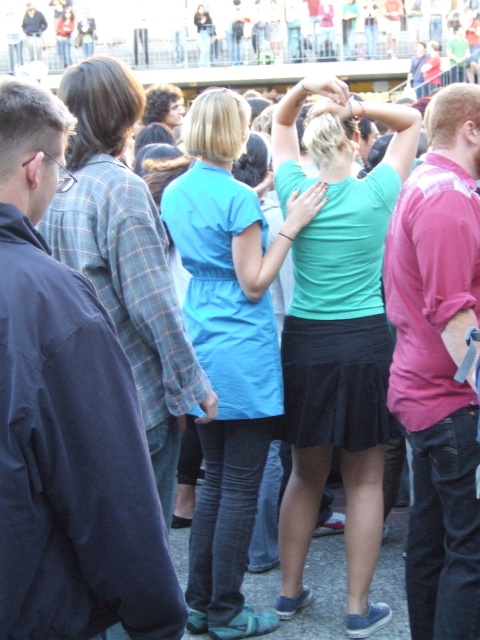
What do you see at coordinates (228, 349) in the screenshot?
I see `matte blue dress at center` at bounding box center [228, 349].

Looking at this image, is matte blue dress at center positioned at the back of pink cotton shirt at right?

That is True.

Identify the location of matte blue dress at center. (228, 349).

Is point (307, 310) positioned after point (195, 573)?

Yes, it is.

Is matte green shirt at center above matte blue dress at center?

Yes, matte green shirt at center is above matte blue dress at center.

What do you see at coordinates (336, 337) in the screenshot? I see `matte green shirt at center` at bounding box center [336, 337].

You are a GUI agent. You are given a task and a screenshot of the screen. Output one action in this format:
    pyautogui.click(x=<x>, y=<y>)
    Task: Click on the matte green shirt at center
    This screenshot has height=640, width=480.
    Given the screenshot: What is the action you would take?
    pyautogui.click(x=336, y=337)

In the scene shown: Does matte green shirt at center appear on the left side of pink cotton shirt at right?

Indeed, matte green shirt at center is positioned on the left side of pink cotton shirt at right.

Does matte green shirt at center have a larger size compared to pink cotton shirt at right?

Indeed, matte green shirt at center has a larger size compared to pink cotton shirt at right.

Does point (365, 595) come closer to viewer compared to point (429, 448)?

No, (365, 595) is further to viewer.

You are a GUI agent. You are given a task and a screenshot of the screen. Output one action in this format:
    pyautogui.click(x=<x>, y=<y>)
    Task: Click on the matte green shirt at center
    
    Given the screenshot: What is the action you would take?
    pyautogui.click(x=336, y=337)